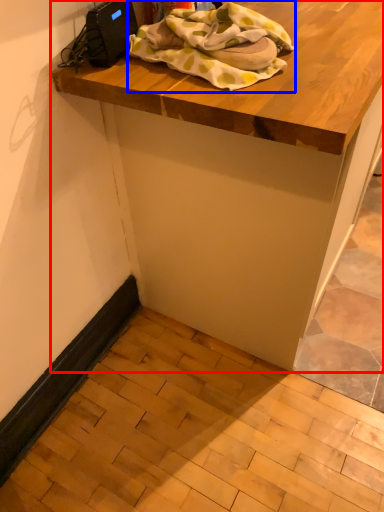
Question: Which object is closer to the camera taking this photo, table (highlighted by a red box) or blanket (highlighted by a blue box)?

Choices:
 (A) table
 (B) blanket

Answer: (A)